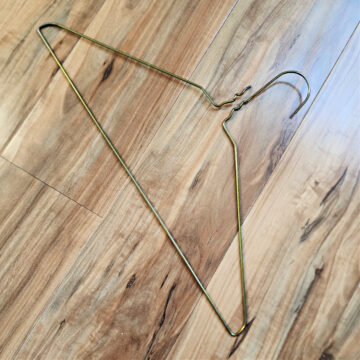
Locate an element on the screen. joint between wood slats on left is located at coordinates (48, 82).